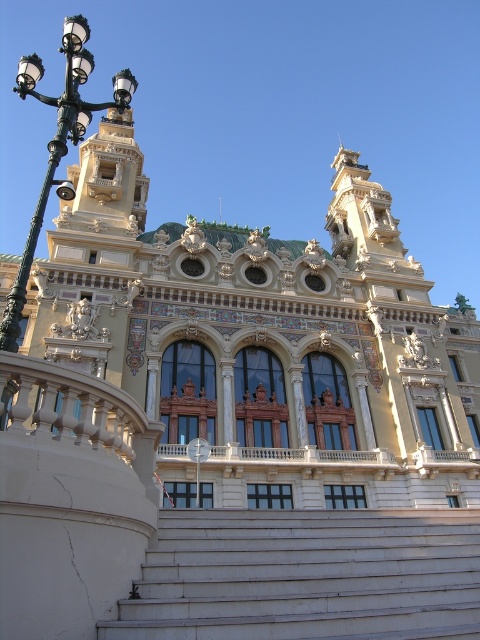
You are standing at the base of the white marble stairs at center in front of a grand building. You want to take a photo of the building with your camera. The camera requires you to be at least 20 meters away from the subject to capture the entire structure in one frame. Can you capture the building in full from your current position?

The white marble stairs at center and camera are 19.94 meters apart from each other. Since the required distance is at least 20 meters, you cannot capture the building in full from your current position.

You are standing at the entrance of the grand building and want to walk towards the white marble stairs at center. Which direction should you walk relative to the black metal streetlight at left?

You should walk towards the white marble stairs at center, which is in front of the black metal streetlight at left. This means you should walk forward in the direction facing away from the streetlight.

You are standing at the entrance of the grand building and want to reach the white marble stairs at center. Which direction should you walk relative to the black metal streetlight at left?

You should walk towards the direction of the white marble stairs at center, which is below the black metal streetlight at left, so you need to move downward from the streetlight.